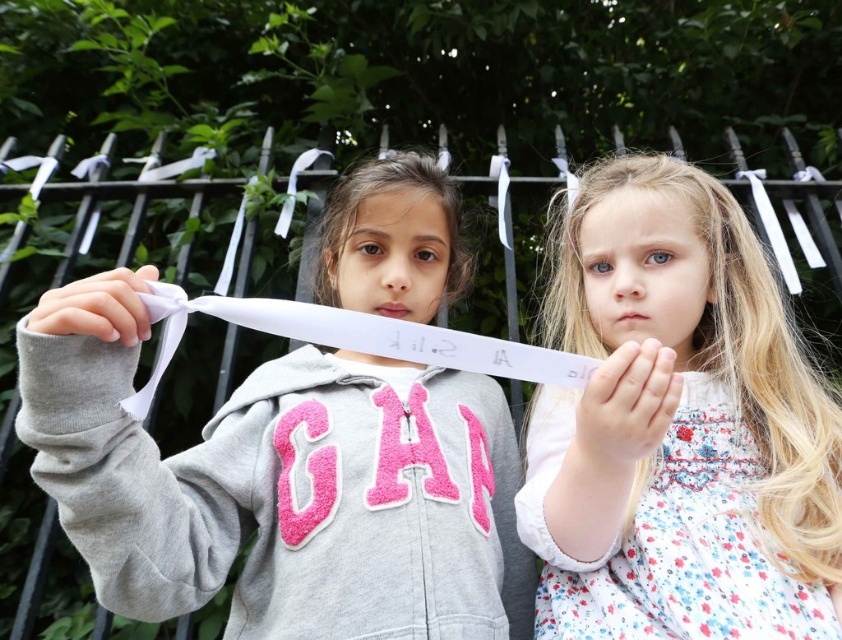
Question: Can you confirm if gray fleece hoodie at center is thinner than white floral dress at center?

Choices:
 (A) no
 (B) yes

Answer: (B)

Question: Among these points, which one is farthest from the camera?

Choices:
 (A) (482, 500)
 (B) (797, 477)

Answer: (A)

Question: Can you confirm if gray fleece hoodie at center is bigger than white floral dress at center?

Choices:
 (A) no
 (B) yes

Answer: (B)

Question: Which point appears closest to the camera in this image?

Choices:
 (A) (83, 458)
 (B) (563, 465)

Answer: (A)

Question: Does gray fleece hoodie at center lie behind white floral dress at center?

Choices:
 (A) yes
 (B) no

Answer: (B)